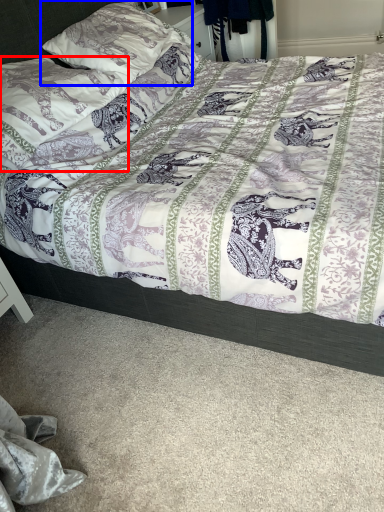
Question: Which of the following is the farthest to the observer, pillow (highlighted by a red box) or pillow (highlighted by a blue box)?

Choices:
 (A) pillow
 (B) pillow

Answer: (B)